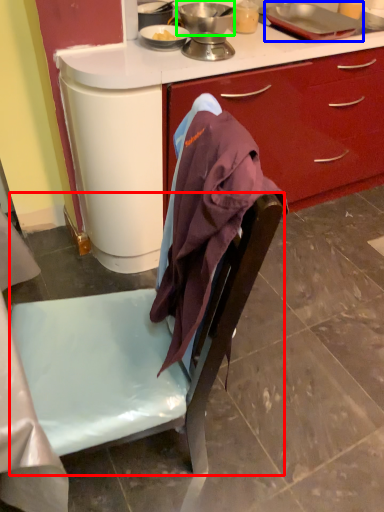
Question: Considering the real-world distances, which object is farthest from chair (highlighted by a red box)? kitchen appliance (highlighted by a blue box) or kitchen appliance (highlighted by a green box)?

Choices:
 (A) kitchen appliance
 (B) kitchen appliance

Answer: (A)